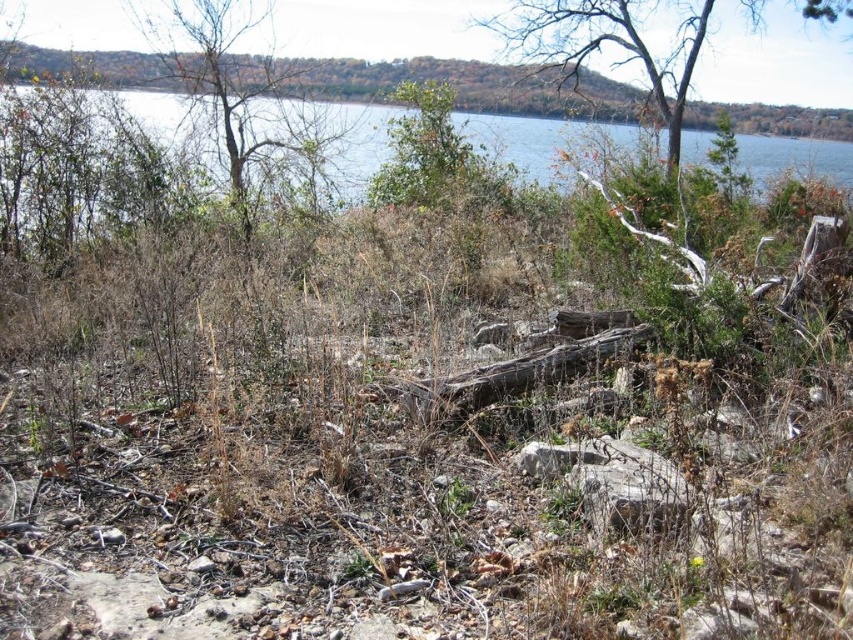
Question: Can you confirm if brown leafy tree at upper center is bigger than brown rough tree trunk at center?

Choices:
 (A) yes
 (B) no

Answer: (A)

Question: In this image, where is bare wood tree at upper center located relative to brown leafy tree at upper center?

Choices:
 (A) right
 (B) left

Answer: (A)

Question: Which object is the closest to the brown rough tree trunk at center?

Choices:
 (A) blue water at upper center
 (B) bare wood tree at upper center
 (C) brown leafy tree at upper center

Answer: (C)

Question: Which object is positioned farthest from the brown rough tree trunk at center?

Choices:
 (A) blue water at upper center
 (B) brown leafy tree at upper center
 (C) bare wood tree at upper center

Answer: (C)

Question: Which point is farther to the camera?

Choices:
 (A) bare wood tree at upper center
 (B) blue water at upper center
 (C) brown leafy tree at upper center
 (D) brown rough tree trunk at center

Answer: (A)

Question: Is blue water at upper center in front of brown rough tree trunk at center?

Choices:
 (A) no
 (B) yes

Answer: (A)